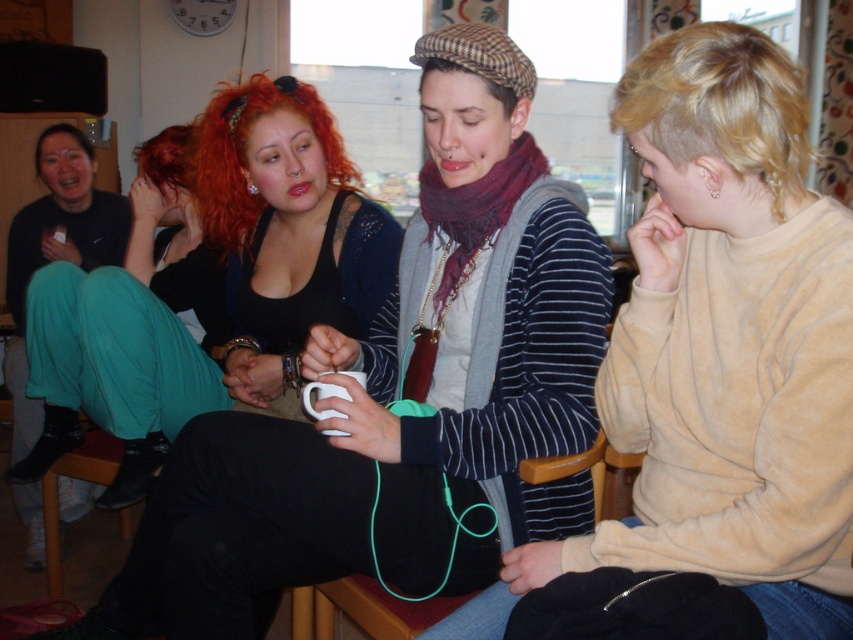
You are a photographer trying to capture a candid shot of the two people at the center of the image, the matte black tank top at center and the striped sweater at center. Since you want to focus on the person closer to you, which one should you aim your camera at?

The matte black tank top at center is closer to you, so you should aim your camera at the matte black tank top at center to focus on the person closer to you.

You are standing in the room and want to determine which of the two points, point (x=236, y=486) or point (x=654, y=465), is nearer to you. Based on the coordinates provided, which point is closer?

Point (x=236, y=486) is closer to you than point (x=654, y=465).

You are a fashion designer observing the group. You notice a specific point at coordinates [402,394]. Which person is this point located on?

The point at coordinates [402,394] is located on the matte black tank top at center.